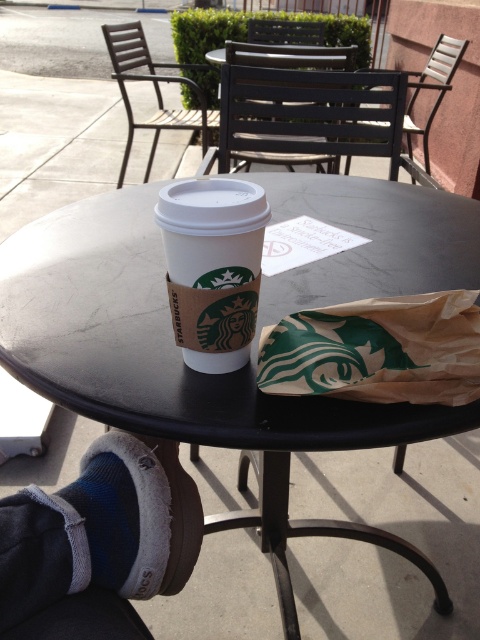
Question: Which object is positioned closest to the matte black chair at center?

Choices:
 (A) gray fleece socks at lower left
 (B) wooden slats chair at upper right
 (C) black matte round table at center

Answer: (B)

Question: Estimate the real-world distances between objects in this image. Which object is closer to the wooden slats chair at upper right?

Choices:
 (A) black matte round table at center
 (B) gray fleece socks at lower left
 (C) brown paper cup at center

Answer: (A)

Question: Does gray fleece socks at lower left appear under wooden slats chair at upper right?

Choices:
 (A) no
 (B) yes

Answer: (B)

Question: Is brown paper cup at center to the right of metallic brown chair at center from the viewer's perspective?

Choices:
 (A) no
 (B) yes

Answer: (B)

Question: Which point is closer to the camera taking this photo?

Choices:
 (A) (205, 131)
 (B) (104, 524)
 (C) (240, 230)

Answer: (C)

Question: Can you confirm if black matte round table at center is positioned to the left of gray fleece socks at lower left?

Choices:
 (A) no
 (B) yes

Answer: (A)